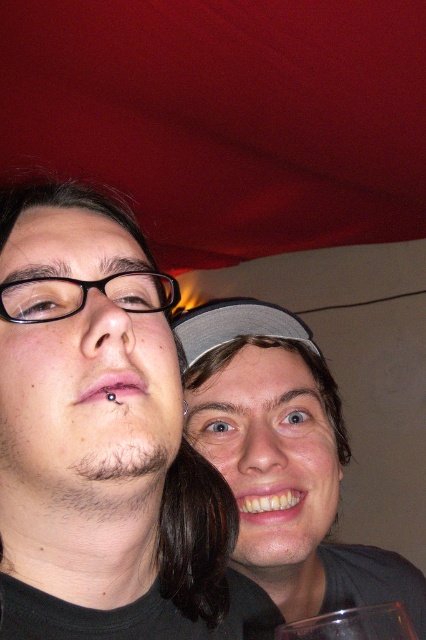
Is matte black hair at upper left taller than matte gray cap at center?

No, matte black hair at upper left is not taller than matte gray cap at center.

Between point (164, 472) and point (420, 628), which one is positioned behind?

Point (420, 628)

Where is `matte black hair at upper left`? matte black hair at upper left is located at coordinates (103, 440).